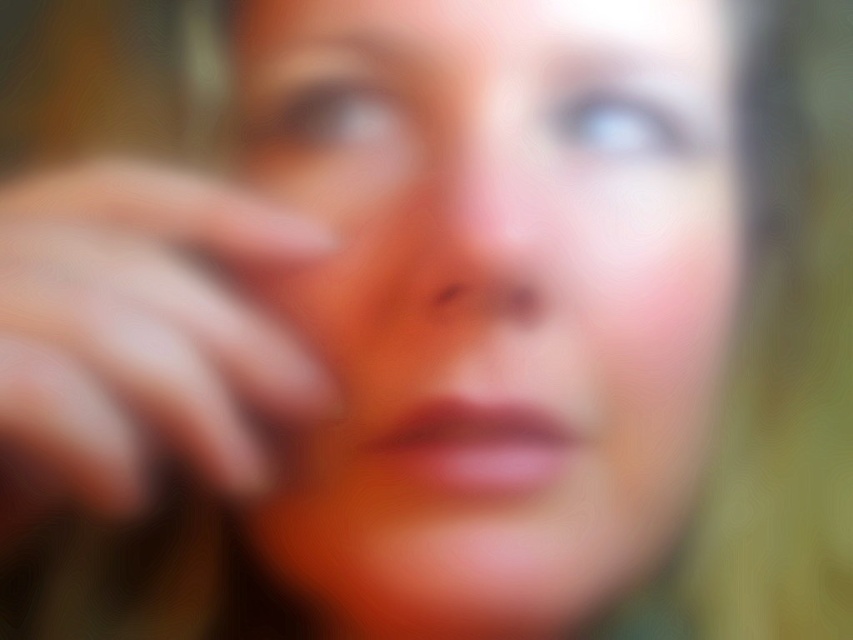
You are an artist analyzing a blurred portrait. You notice two points in the image at coordinates point (x=469, y=188) and point (x=212, y=224). Which point is closer to you?

Point (x=469, y=188) is further to the viewer than point (x=212, y=224), so the closer point is point (x=212, y=224).

You are an artist trying to paint a portrait based on the image. You need to decide which part to focus on first. According to the image, which object is bigger between the smooth skin face at center and the smooth skin hand at center?

The smooth skin face at center is larger in size than the smooth skin hand at center, so you should focus on the smooth skin face at center first.

You are a photographer trying to adjust the focus on your camera. You notice two points in the image, point (109, 202) and point (532, 291). If you want to focus on the point that is closer to the camera, which point should you choose?

Point (109, 202) is in front of point (532, 291), so you should focus on point (109, 202) to capture the closer one.